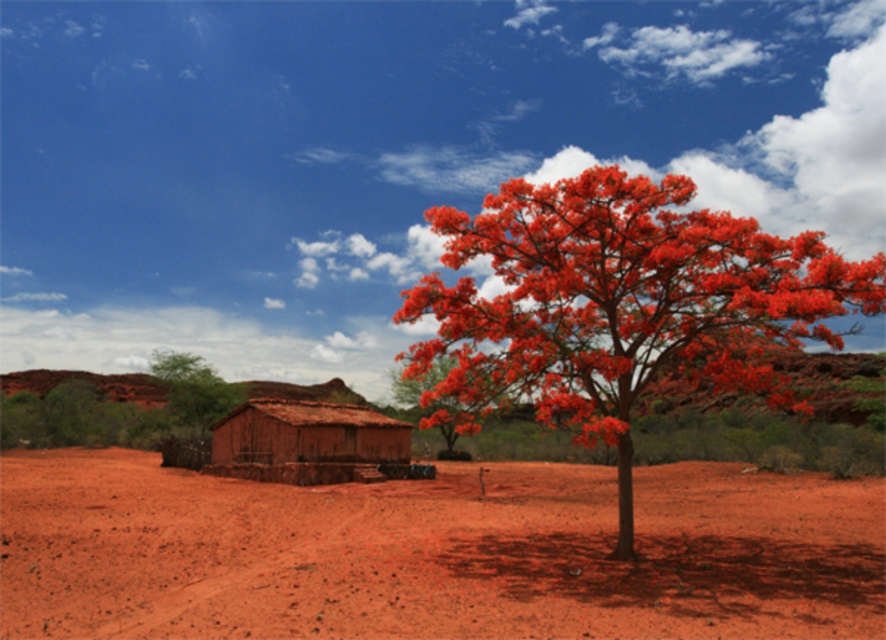
You are standing at the point marked by coordinates point (x=432, y=552) in the image. Describe what you see around you based on the scene description provided.

The point (x=432, y=552) marks the dusty red dirt field at center, so you are standing in the middle of a dusty red dirt field surrounded by a striking tree with vibrant red blossoms in the foreground and a small rustic mud or clay structure with a thatched roof in the background.

From the picture: You are an artist trying to paint this scene. You notice the bright red petal at upper right and the brown clay hut at center. Which object should you draw first if you want to maintain proper perspective, considering their sizes and positions?

The bright red petal at upper right should be drawn first because it is larger than the brown clay hut at center, indicating it is closer to the viewer and should be placed in the foreground to maintain perspective.